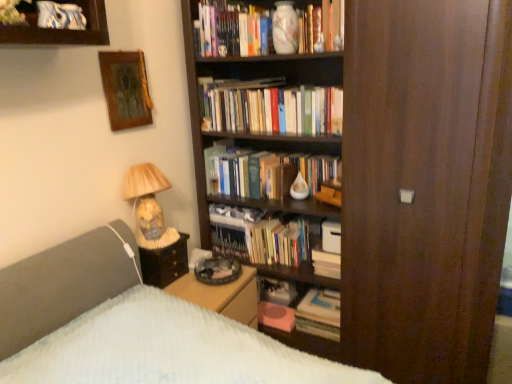
The width and height of the screenshot is (512, 384). What do you see at coordinates (125, 89) in the screenshot?
I see `wooden picture frame at upper left` at bounding box center [125, 89].

What do you see at coordinates (407, 179) in the screenshot? The width and height of the screenshot is (512, 384). I see `wooden screen door at right` at bounding box center [407, 179].

What do you see at coordinates (271, 108) in the screenshot? The width and height of the screenshot is (512, 384). I see `hardcover books at center, which is the 3th book from bottom to top` at bounding box center [271, 108].

This screenshot has height=384, width=512. What are the coordinates of `hardcover book at center, the 3th book positioned from the top` in the screenshot? It's located at (319, 315).

What is the approximate width of white paper stack at center, the 2th book from the top?

white paper stack at center, the 2th book from the top, is 5.32 inches wide.

Locate an element on the screen. wooden side table at lower left is located at coordinates (164, 263).

Identify the location of wooden picture frame at upper left. (125, 89).

Can you see wooden side table at lower left touching wooden screen door at right?

No.

Is wooden side table at lower left wider or thinner than wooden screen door at right?

wooden side table at lower left is thinner than wooden screen door at right.

What are the coordinates of `side table located behind the wooden screen door at right` in the screenshot? It's located at (164, 263).

From the picture: Relative to white paper stack at center, the 2th book from the top, is wooden side table at lower left in front or behind?

Visually, wooden side table at lower left is located in front of white paper stack at center, the 2th book from the top.

Is wooden side table at lower left thinner than white paper stack at center, placed as the second book when sorted from bottom to top?

In fact, wooden side table at lower left might be wider than white paper stack at center, placed as the second book when sorted from bottom to top.

Based on the photo, from the image's perspective, is wooden side table at lower left above or below white paper stack at center, the 2th book from the top?

wooden side table at lower left is situated higher than white paper stack at center, the 2th book from the top, in the image.

Would you consider wooden side table at lower left to be distant from white paper stack at center, placed as the second book when sorted from bottom to top?

wooden side table at lower left is near white paper stack at center, placed as the second book when sorted from bottom to top, not far away.

From a real-world perspective, is wooden screen door at right over white matte paperback book at center?

Correct, in the physical world, wooden screen door at right is higher than white matte paperback book at center.

In the image, is wooden screen door at right positioned in front of or behind white matte paperback book at center?

wooden screen door at right is positioned closer to the viewer than white matte paperback book at center.

Is wooden screen door at right situated inside white matte paperback book at center or outside?

wooden screen door at right lies outside white matte paperback book at center.

From the image's perspective, which is below, wooden screen door at right or white matte paperback book at center?

white matte paperback book at center.

From the image's perspective, is matte glass lamp at left below wooden picture frame at upper left?

Correct, matte glass lamp at left appears lower than wooden picture frame at upper left in the image.

Between matte glass lamp at left and wooden picture frame at upper left, which one has less height?

With less height is wooden picture frame at upper left.

Is matte glass lamp at left aimed at wooden picture frame at upper left?

No, matte glass lamp at left is not turned towards wooden picture frame at upper left.

What's the angular difference between matte glass lamp at left and wooden picture frame at upper left's facing directions?

They differ by 0.122 degrees in their facing directions.

From a real-world perspective, is hardcover books at center, the first book in the top-to-bottom sequence, located beneath hardcover book at center, the 3th book positioned from the top?

No, from a real-world perspective, hardcover books at center, the first book in the top-to-bottom sequence, is not below hardcover book at center, the 3th book positioned from the top.

Considering the sizes of hardcover books at center, the first book in the top-to-bottom sequence, and hardcover book at center, the 3th book positioned from the top, in the image, is hardcover books at center, the first book in the top-to-bottom sequence, wider or thinner than hardcover book at center, the 3th book positioned from the top,?

Clearly, hardcover books at center, the first book in the top-to-bottom sequence, has less width compared to hardcover book at center, the 3th book positioned from the top.

Is hardcover books at center, which is the 3th book from bottom to top, smaller than hardcover book at center, the 3th book positioned from the top?

Incorrect, hardcover books at center, which is the 3th book from bottom to top, is not smaller in size than hardcover book at center, the 3th book positioned from the top.

Can you tell me how much wooden picture frame at upper left and white paper stack at center, the 2th book from the top, differ in facing direction?

87.1 degrees.

Is wooden picture frame at upper left looking in the opposite direction of white paper stack at center, the 2th book from the top?

wooden picture frame at upper left does not have its back to white paper stack at center, the 2th book from the top.

Locate an element on the screen. the 2nd book below the wooden picture frame at upper left (from the image's perspective) is located at coordinates (328, 251).

Is wooden picture frame at upper left bigger or smaller than white paper stack at center, the 2th book from the top?

Clearly, wooden picture frame at upper left is larger in size than white paper stack at center, the 2th book from the top.

Which object is more forward, matte glass lamp at left or wooden side table at lower left?

matte glass lamp at left is closer to the camera.

Is matte glass lamp at left wider than wooden side table at lower left?

Incorrect, the width of matte glass lamp at left does not surpass that of wooden side table at lower left.

Between point (136, 209) and point (175, 270), which one is positioned behind?

The point (175, 270) is more distant.

You are a GUI agent. You are given a task and a screenshot of the screen. Output one action in this format:
    pyautogui.click(x=<x>, y=<y>)
    Task: Click on the screen door located in front of the wooden side table at lower left
    The image size is (512, 384).
    Given the screenshot: What is the action you would take?
    pyautogui.click(x=407, y=179)

Identify the location of side table above the white paper stack at center, placed as the second book when sorted from bottom to top (from a real-world perspective). Image resolution: width=512 pixels, height=384 pixels. pyautogui.click(x=164, y=263).

Looking at the image, which one is located closer to wooden side table at lower left, white matte paperback book at center or matte glass lamp at left?

matte glass lamp at left is positioned closer to the anchor wooden side table at lower left.

Looking at the image, which one is located closer to matte glass lamp at left, hardcover book at center, the 3th book positioned from the top, or white paper stack at center, the 2th book from the top?

The object closer to matte glass lamp at left is white paper stack at center, the 2th book from the top.

Which object lies further to the anchor point white paper stack at center, the 2th book from the top, hardcover books at center, which is the 3th book from bottom to top, or wooden picture frame at upper left?

Based on the image, wooden picture frame at upper left appears to be further to white paper stack at center, the 2th book from the top.

When comparing their distances from hardcover books at center, the first book in the top-to-bottom sequence, does hardcover book at center, marked as the first book in a bottom-to-top arrangement, or white matte paperback book at center seem closer?

Based on the image, white matte paperback book at center appears to be nearer to hardcover books at center, the first book in the top-to-bottom sequence.

Based on their spatial positions, is matte glass lamp at left or hardcover book at center, marked as the first book in a bottom-to-top arrangement, further from white paper stack at center, placed as the second book when sorted from bottom to top?

matte glass lamp at left lies further to white paper stack at center, placed as the second book when sorted from bottom to top, than the other object.

Looking at the image, which one is located closer to hardcover book at center, the 3th book positioned from the top, hardcover books at center, the first book in the top-to-bottom sequence, or white paper stack at center, placed as the second book when sorted from bottom to top?

white paper stack at center, placed as the second book when sorted from bottom to top.

Which object lies further to the anchor point matte glass lamp at left, wooden screen door at right or wooden picture frame at upper left?

wooden screen door at right is positioned further to the anchor matte glass lamp at left.

Looking at the image, which one is located further to hardcover books at center, the first book in the top-to-bottom sequence, wooden screen door at right or white matte paperback book at center?

Based on the image, wooden screen door at right appears to be further to hardcover books at center, the first book in the top-to-bottom sequence.

The height and width of the screenshot is (384, 512). I want to click on paperback book between wooden side table at lower left and wooden screen door at right, so click(x=331, y=237).

Locate an element on the screen. Image resolution: width=512 pixels, height=384 pixels. side table between wooden screen door at right and hardcover book at center, the 3th book positioned from the top, in the front-back direction is located at coordinates (164, 263).

What are the coordinates of `paperback book between wooden screen door at right and white paper stack at center, the 2th book from the top, along the z-axis` in the screenshot? It's located at (331, 237).

Where is `lamp between hardcover books at center, which is the 3th book from bottom to top, and wooden side table at lower left in the up-down direction`? This screenshot has height=384, width=512. lamp between hardcover books at center, which is the 3th book from bottom to top, and wooden side table at lower left in the up-down direction is located at coordinates (146, 198).